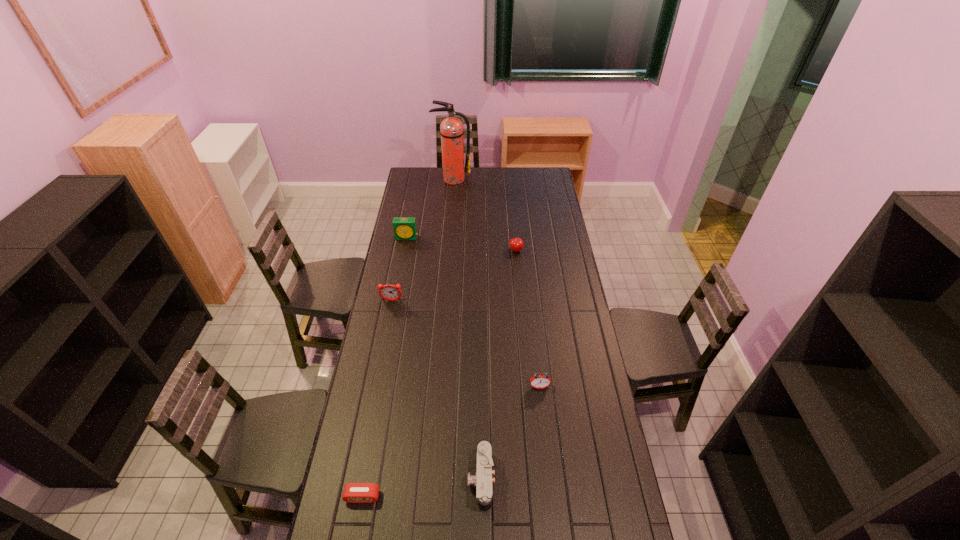
Where is `free spot at the far edge of the desktop`? This screenshot has width=960, height=540. free spot at the far edge of the desktop is located at coordinates (477, 168).

The image size is (960, 540). In the image, there is a desktop. Find the location of `vacant space at the left edge`. vacant space at the left edge is located at coordinates (391, 363).

This screenshot has height=540, width=960. Find the location of `vacant area at the right edge of the desktop`. vacant area at the right edge of the desktop is located at coordinates (532, 193).

What are the coordinates of `vacant space at the far right corner` in the screenshot? It's located at (546, 177).

Where is `free space between the farthest alarm clock and the fourth object from right to left`? The height and width of the screenshot is (540, 960). free space between the farthest alarm clock and the fourth object from right to left is located at coordinates (430, 208).

In order to click on vacant area that lies between the second farthest object and the third farthest alarm clock in this screenshot , I will do `click(473, 312)`.

Locate an element on the screen. This screenshot has height=540, width=960. empty space between the cherry and the shortest object is located at coordinates (439, 374).

Locate an element on the screen. free spot between the second nearest alarm clock and the farthest object is located at coordinates (496, 283).

Where is `vacant region between the shortest alarm clock and the camera`? The width and height of the screenshot is (960, 540). vacant region between the shortest alarm clock and the camera is located at coordinates (421, 488).

Locate an element on the screen. free point between the cherry and the second farthest alarm clock is located at coordinates (454, 276).